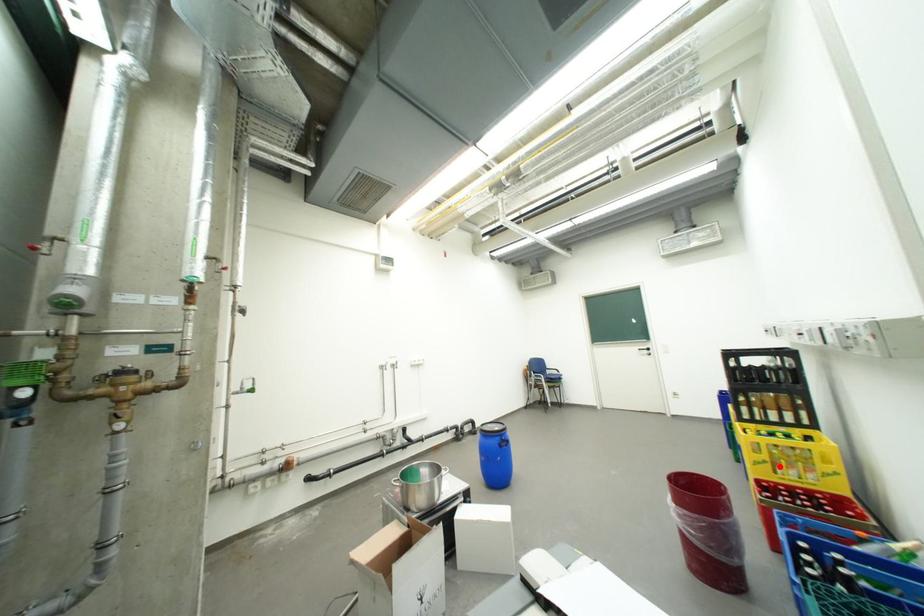
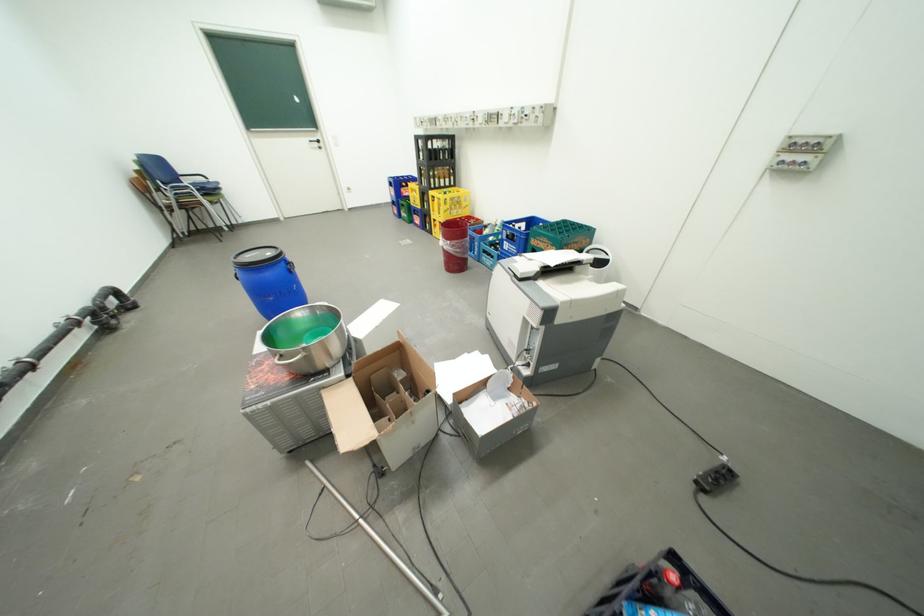
The point at the highlighted location is marked in the first image. Where is the corresponding point in the second image?

(459, 212)